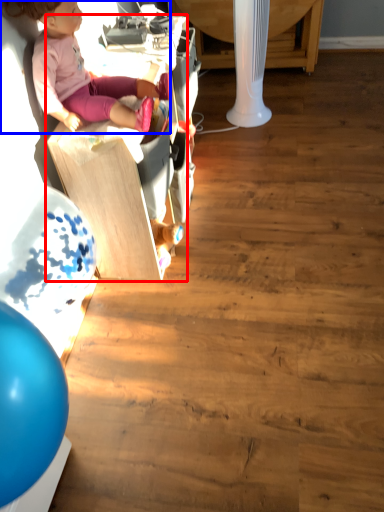
Question: Among these objects, which one is farthest to the camera, furniture (highlighted by a red box) or person (highlighted by a blue box)?

Choices:
 (A) furniture
 (B) person

Answer: (A)